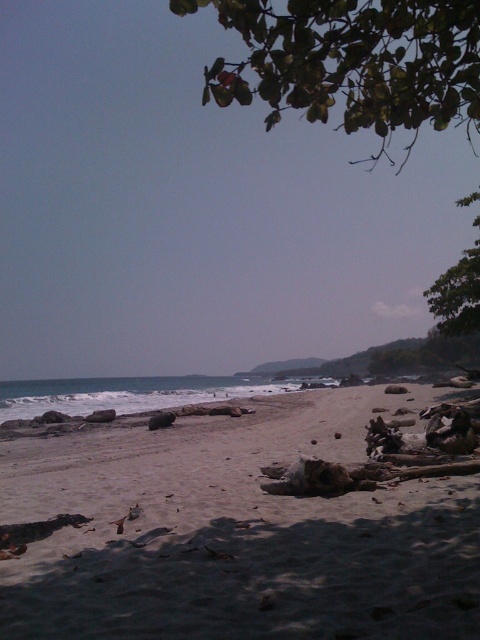
Can you confirm if blue water at lower left is smaller than green leafy tree at upper right?

Correct, blue water at lower left occupies less space than green leafy tree at upper right.

Is point (204, 378) farther from viewer compared to point (441, 285)?

That is True.

Where is `blue water at lower left`? The width and height of the screenshot is (480, 640). blue water at lower left is located at coordinates (127, 394).

In the scene shown: Measure the distance from green leafy branch at upper center to green leafy tree at upper right.

green leafy branch at upper center is 20.20 meters from green leafy tree at upper right.

Does green leafy branch at upper center have a smaller size compared to green leafy tree at upper right?

No, green leafy branch at upper center is not smaller than green leafy tree at upper right.

This screenshot has height=640, width=480. Describe the element at coordinates (354, 61) in the screenshot. I see `green leafy branch at upper center` at that location.

At what (x,y) coordinates should I click in order to perform the action: click on green leafy branch at upper center. Please return your answer as a coordinate pair (x, y). This screenshot has width=480, height=640. Looking at the image, I should click on (354, 61).

Which is more to the left, white sandy beach at center or green leafy branch at upper center?

Positioned to the left is white sandy beach at center.

Is white sandy beach at center to the right of green leafy branch at upper center from the viewer's perspective?

Incorrect, white sandy beach at center is not on the right side of green leafy branch at upper center.

Is point (175, 592) more distant than point (456, 61)?

That is False.

Locate an element on the screen. The height and width of the screenshot is (640, 480). white sandy beach at center is located at coordinates (235, 534).